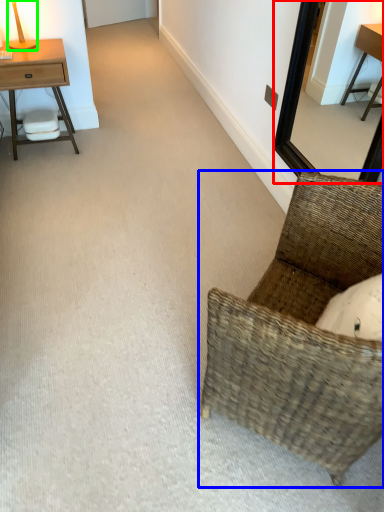
Question: Considering the real-world distances, which object is farthest from mirror (highlighted by a red box)? chair (highlighted by a blue box) or table lamp (highlighted by a green box)?

Choices:
 (A) chair
 (B) table lamp

Answer: (B)